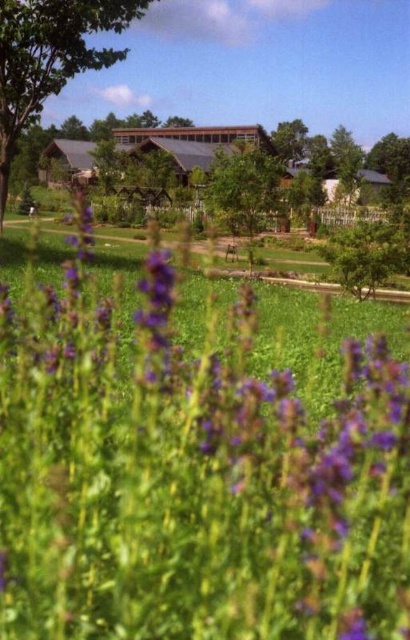
You are standing in the garden and want to place a small decorative statue. There are two points marked in the image where you can place it. The first point is at coordinate point (172, 532) and the second is at coordinate point (11, 113). Which point is closer to you where you can place the statue?

Point (172, 532) is closer to the viewer than point (11, 113), so you should place the statue there.